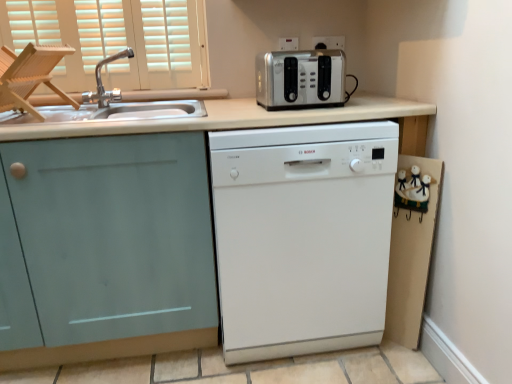
Question: Is wooden folding chair at left taller or shorter than white glossy dishwasher at center?

Choices:
 (A) tall
 (B) short

Answer: (B)

Question: Is wooden folding chair at left in front of or behind white glossy dishwasher at center in the image?

Choices:
 (A) behind
 (B) front

Answer: (A)

Question: Estimate the real-world distances between objects in this image. Which object is farther from the silver metallic outlet at upper center, which ranks as the 1th electric outlet in left-to-right order?

Choices:
 (A) metallic silver outlet at upper center, the first electric outlet positioned from the right
 (B) matte teal cabinet at left
 (C) satin silver toaster at upper center
 (D) brushed metal faucet at upper left
 (E) white glossy dishwasher at center

Answer: (B)

Question: Considering the real-world distances, which object is farthest from the silver metallic outlet at upper center, which ranks as the 1th electric outlet in left-to-right order?

Choices:
 (A) wooden folding chair at left
 (B) satin silver toaster at upper center
 (C) brushed metal faucet at upper left
 (D) metallic silver outlet at upper center, the first electric outlet positioned from the right
 (E) matte teal cabinet at left

Answer: (E)